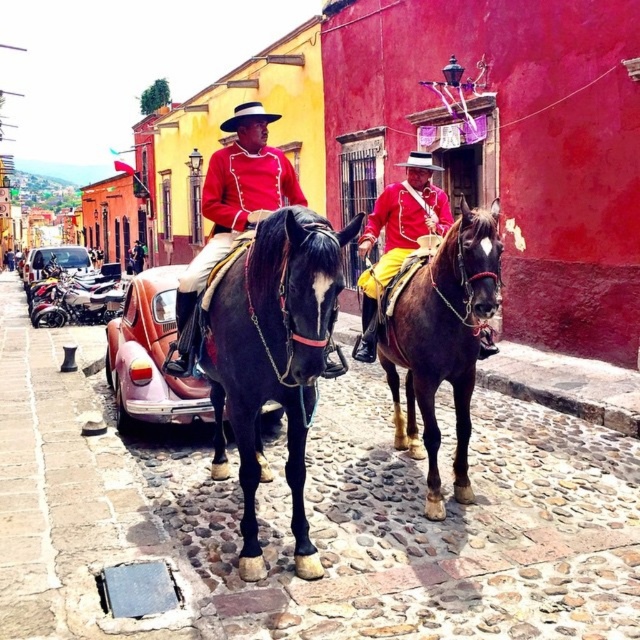
You are a tourist standing at the edge of the street and want to take a photo of both the black glossy horse at center and the brown glossy horse at center. Which horse should you focus on first to ensure both are in the frame?

You should focus on the brown glossy horse at center first because it is taller than the black glossy horse at center, ensuring both are in the frame.